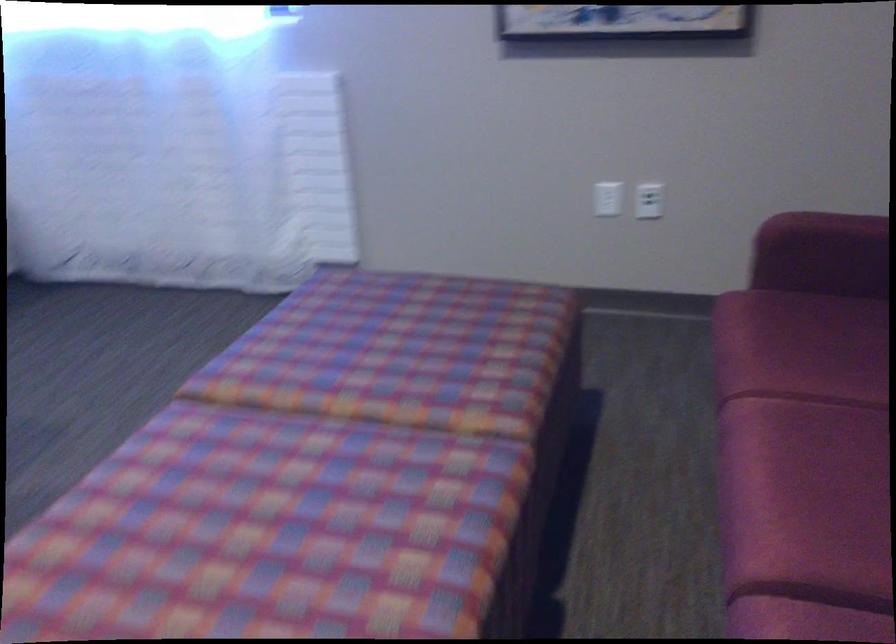
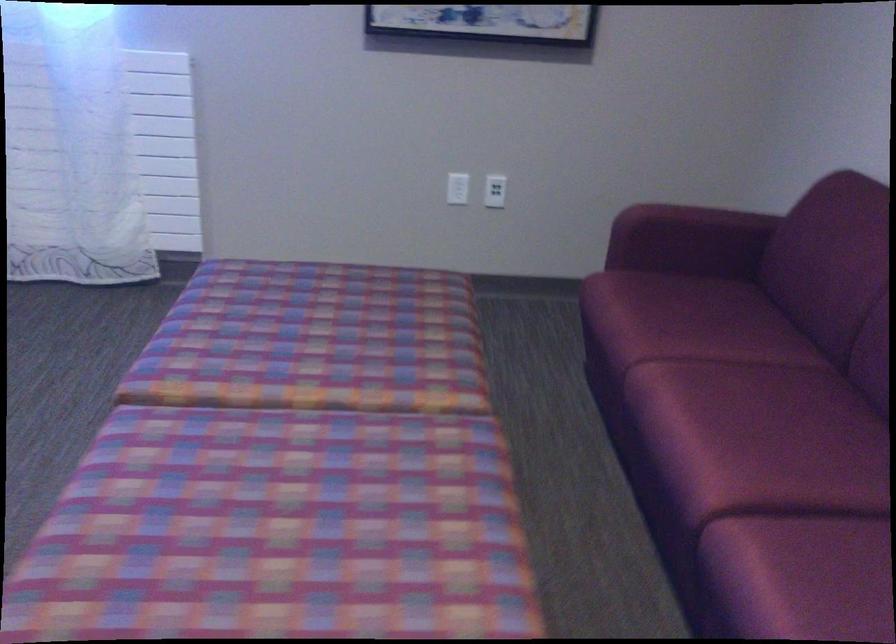
Question: I am providing you with two images of the same scene from different viewpoints. Which of the following objects are not visible in image2?

Choices:
 (A) sofa sitting surface
 (B) white power outlet
 (C) sofa armrest
 (D) none of these

Answer: (D)